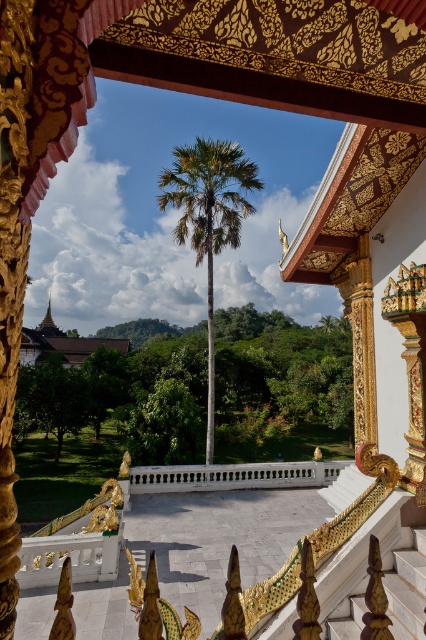
You are an architect designing a new garden layout. You have to place the green leafy palm at center and the white marble balustrade at center in such a way that they are both visible from the main entrance. Given their sizes, which object should be placed closer to the entrance to ensure both are clearly visible?

The green leafy palm at center is bigger than the white marble balustrade at center, so to ensure both are clearly visible from the main entrance, the smaller white marble balustrade at center should be placed closer to the entrance. This way, the larger palm can be seen behind it without being obscured.

You are standing on the temple terrace and want to walk towards the green leafy palm at center and the white marble balustrade at center. Which object will you encounter first as you move forward?

You will encounter the green leafy palm at center first because it is closer to you than the white marble balustrade at center.